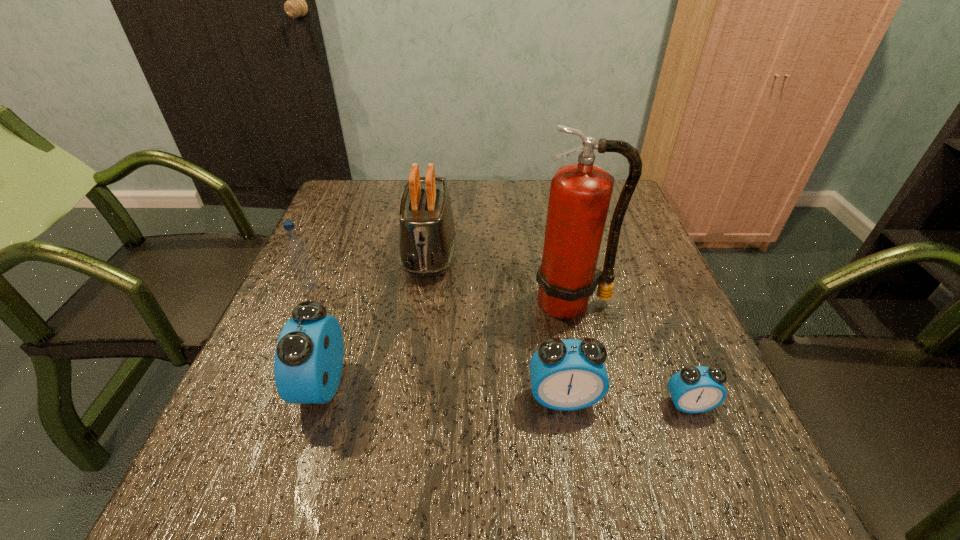
Locate an element on the screen. vacant area between the fire extinguisher and the leftmost alarm clock is located at coordinates (447, 344).

You are a GUI agent. You are given a task and a screenshot of the screen. Output one action in this format:
    pyautogui.click(x=<x>, y=<y>)
    Task: Click on the free space between the second alarm clock from right to left and the second tallest object
    The width and height of the screenshot is (960, 540).
    Given the screenshot: What is the action you would take?
    pyautogui.click(x=496, y=325)

Find the location of a particular element. The height and width of the screenshot is (540, 960). free space between the toaster and the fire extinguisher is located at coordinates (500, 278).

At what (x,y) coordinates should I click in order to perform the action: click on free space between the toaster and the rightmost alarm clock. Please return your answer as a coordinate pair (x, y). The width and height of the screenshot is (960, 540). Looking at the image, I should click on pyautogui.click(x=559, y=328).

Point out which object is positioned as the second nearest to the fifth shortest object. Please provide its 2D coordinates. Your answer should be formatted as a tuple, i.e. [(x, y)], where the tuple contains the x and y coordinates of a point satisfying the conditions above.

[(580, 193)]

Locate which object ranks in proximity to the water bottle. Please provide its 2D coordinates. Your answer should be formatted as a tuple, i.e. [(x, y)], where the tuple contains the x and y coordinates of a point satisfying the conditions above.

[(427, 237)]

Locate an element on the screen. This screenshot has width=960, height=540. alarm clock that is the second closest to the leftmost object is located at coordinates (570, 374).

Where is `alarm clock that is the closest to the leftmost alarm clock`? This screenshot has height=540, width=960. alarm clock that is the closest to the leftmost alarm clock is located at coordinates (570, 374).

Where is `vacant area in the image that satisfies the following two spatial constraints: 1. on the side of the toaster with the control lever; 2. on the face of the leftmost alarm clock`? This screenshot has height=540, width=960. vacant area in the image that satisfies the following two spatial constraints: 1. on the side of the toaster with the control lever; 2. on the face of the leftmost alarm clock is located at coordinates (411, 385).